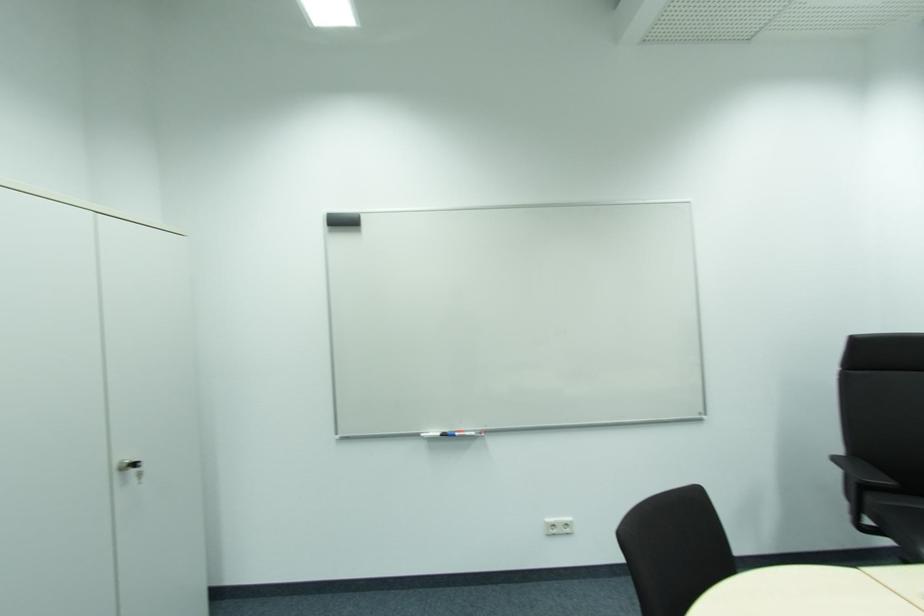
Find where to pull the silver cabinet key. Please return your answer as a coordinate pair (x, y).

(131, 468)